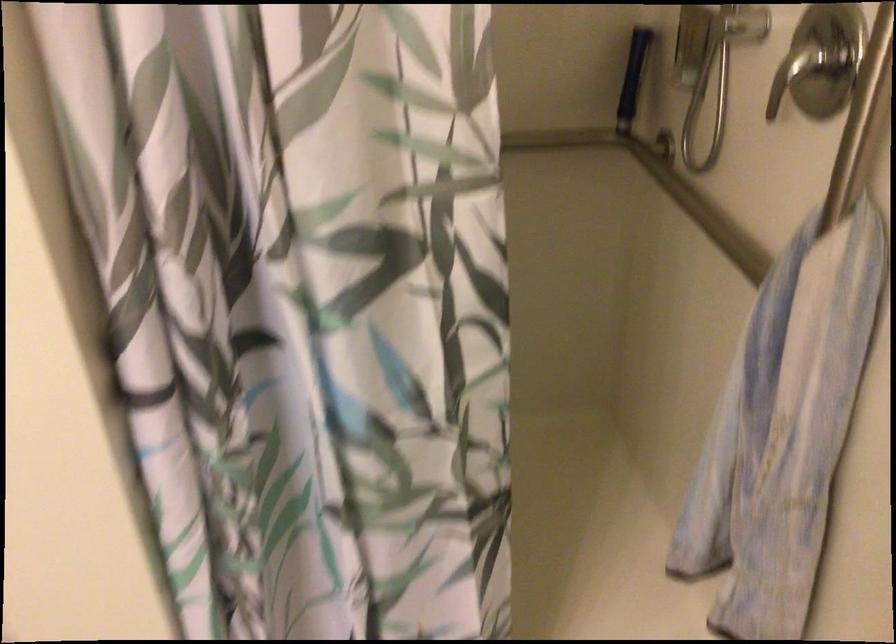
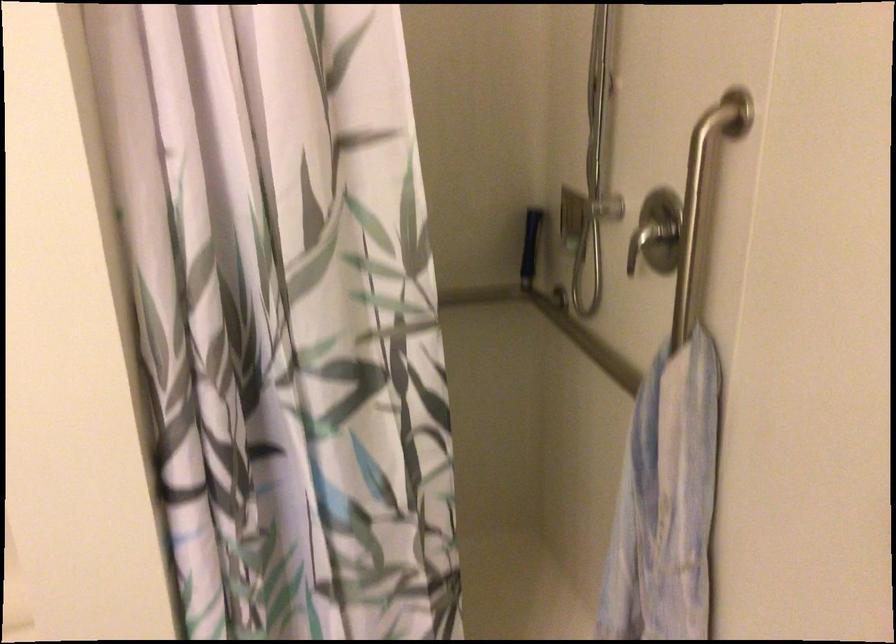
Find the pixel in the second image that matches (693,207) in the first image.

(586, 341)